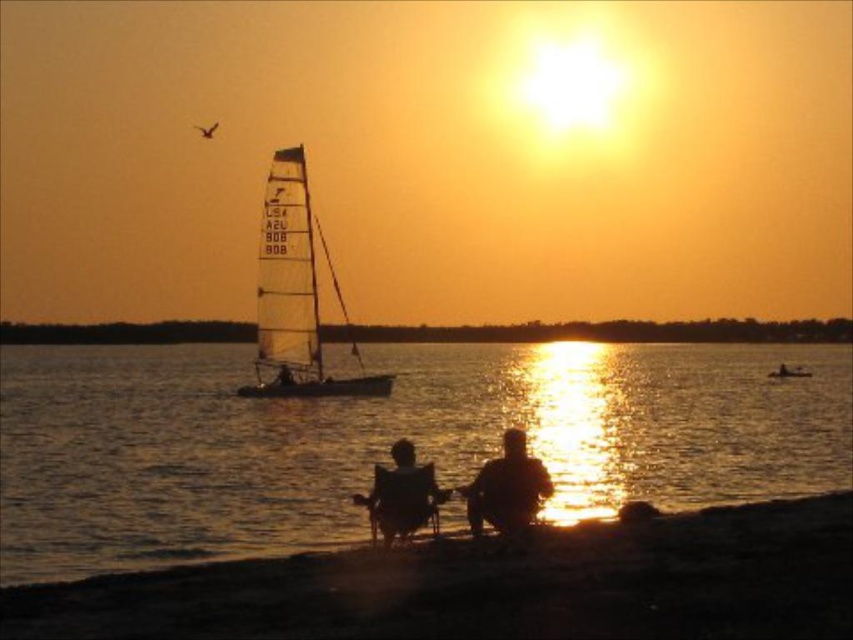
Question: Is dark sand shoreline at lower center thinner than silhouette fabric person at lower center?

Choices:
 (A) yes
 (B) no

Answer: (B)

Question: Observing the image, what is the correct spatial positioning of white translucent sailboat at center in reference to metallic silver sailboat at center?

Choices:
 (A) right
 (B) left

Answer: (B)

Question: Among these points, which one is farthest from the camera?

Choices:
 (A) (476, 522)
 (B) (428, 477)
 (C) (544, 634)

Answer: (B)

Question: Is silvery reflective water at center below silhouette fabric chairs at lower center?

Choices:
 (A) yes
 (B) no

Answer: (B)

Question: Which point is farther to the camera?

Choices:
 (A) silhouette fabric chairs at lower center
 (B) smooth orange sky at center

Answer: (B)

Question: Which object is positioned farthest from the silhouette fabric chairs at lower center?

Choices:
 (A) silhouette fabric person at lower center
 (B) dark sand shoreline at lower center
 (C) white translucent sailboat at center

Answer: (C)